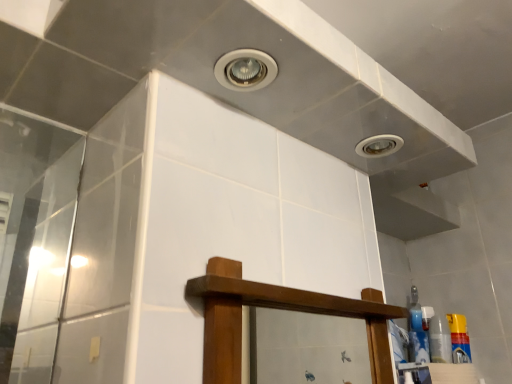
This screenshot has height=384, width=512. I want to click on matte white droplight at upper right, so [x=379, y=146].

What do you see at coordinates (379, 146) in the screenshot? I see `matte white droplight at upper right` at bounding box center [379, 146].

Describe the element at coordinates (459, 338) in the screenshot. I see `yellow plastic spray can at right` at that location.

In order to click on yellow plastic spray can at right in this screenshot , I will do `click(459, 338)`.

You are a GUI agent. You are given a task and a screenshot of the screen. Output one action in this format:
    pyautogui.click(x=<x>, y=<y>)
    Task: Click on the matte white droplight at upper right
    
    Given the screenshot: What is the action you would take?
    (379, 146)

Does matte white droplight at upper right appear on the left side of yellow plastic spray can at right?

Yes, matte white droplight at upper right is to the left of yellow plastic spray can at right.

Considering the relative positions of matte white droplight at upper right and yellow plastic spray can at right in the image provided, is matte white droplight at upper right behind yellow plastic spray can at right?

No, the depth of matte white droplight at upper right is less than that of yellow plastic spray can at right.

Considering the points (362, 141) and (464, 332), which point is in front, point (362, 141) or point (464, 332)?

Point (362, 141)

From the image's perspective, does matte white droplight at upper right appear lower than yellow plastic spray can at right?

Actually, matte white droplight at upper right appears above yellow plastic spray can at right in the image.

From a real-world perspective, is matte white droplight at upper right positioned under yellow plastic spray can at right based on gravity?

No, from a real-world perspective, matte white droplight at upper right is not below yellow plastic spray can at right.

Considering the sizes of matte white droplight at upper right and yellow plastic spray can at right in the image, is matte white droplight at upper right wider or thinner than yellow plastic spray can at right?

Considering their sizes, matte white droplight at upper right looks broader than yellow plastic spray can at right.

Between matte white droplight at upper right and yellow plastic spray can at right, which one has less height?

With less height is matte white droplight at upper right.

From the picture: Who is smaller, matte white droplight at upper right or yellow plastic spray can at right?

With smaller size is matte white droplight at upper right.

Is matte white droplight at upper right completely or partially outside of yellow plastic spray can at right?

Indeed, matte white droplight at upper right is completely outside yellow plastic spray can at right.

Is matte white droplight at upper right in contact with yellow plastic spray can at right?

No, matte white droplight at upper right is not in contact with yellow plastic spray can at right.

Is matte white droplight at upper right aimed at yellow plastic spray can at right?

No, matte white droplight at upper right is not oriented towards yellow plastic spray can at right.

How different are the orientations of matte white droplight at upper right and yellow plastic spray can at right in degrees?

There is a 0.00199-degree angle between the facing directions of matte white droplight at upper right and yellow plastic spray can at right.

The width and height of the screenshot is (512, 384). I want to click on droplight in front of the yellow plastic spray can at right, so click(379, 146).

Looking at this image, which is more to the left, yellow plastic spray can at right or matte white droplight at upper right?

Positioned to the left is matte white droplight at upper right.

Is yellow plastic spray can at right further to camera compared to matte white droplight at upper right?

Yes, yellow plastic spray can at right is further from the camera.

Considering the positions of point (453, 359) and point (365, 147), is point (453, 359) closer or farther from the camera than point (365, 147)?

Point (453, 359) appears to be farther away from the viewer than point (365, 147).

From the image's perspective, relative to matte white droplight at upper right, is yellow plastic spray can at right above or below?

Clearly, from the image's perspective, yellow plastic spray can at right is below matte white droplight at upper right.

From a real-world perspective, is yellow plastic spray can at right beneath matte white droplight at upper right?

Yes.

Considering the relative sizes of yellow plastic spray can at right and matte white droplight at upper right in the image provided, is yellow plastic spray can at right wider than matte white droplight at upper right?

In fact, yellow plastic spray can at right might be narrower than matte white droplight at upper right.

Is yellow plastic spray can at right taller or shorter than matte white droplight at upper right?

In the image, yellow plastic spray can at right appears to be taller than matte white droplight at upper right.

Based on the photo, can you confirm if yellow plastic spray can at right is smaller than matte white droplight at upper right?

No.

Is yellow plastic spray can at right outside of matte white droplight at upper right?

Yes, yellow plastic spray can at right is located beyond the bounds of matte white droplight at upper right.

Are yellow plastic spray can at right and matte white droplight at upper right far apart?

No, yellow plastic spray can at right is not far from matte white droplight at upper right.

Is yellow plastic spray can at right positioned with its back to matte white droplight at upper right?

No, yellow plastic spray can at right is not facing the opposite direction of matte white droplight at upper right.

Measure the distance from yellow plastic spray can at right to matte white droplight at upper right.

A distance of 24.82 inches exists between yellow plastic spray can at right and matte white droplight at upper right.

Locate an element on the screen. This screenshot has height=384, width=512. droplight on the left of yellow plastic spray can at right is located at coordinates (379, 146).

Where is `droplight located above the yellow plastic spray can at right (from a real-world perspective)`? This screenshot has width=512, height=384. droplight located above the yellow plastic spray can at right (from a real-world perspective) is located at coordinates (379, 146).

I want to click on toiletry below the matte white droplight at upper right (from a real-world perspective), so click(x=459, y=338).